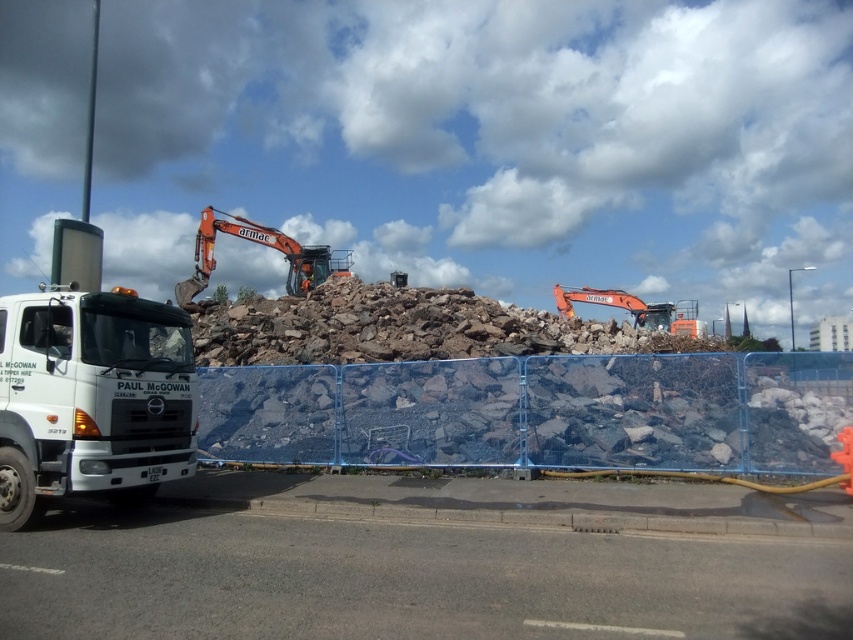
Is blue plastic fence at center positioned before orange metallic excavator at upper center?

Yes, blue plastic fence at center is closer to the viewer.

Does blue plastic fence at center have a lesser width compared to orange metallic excavator at upper center?

Yes, blue plastic fence at center is thinner than orange metallic excavator at upper center.

The width and height of the screenshot is (853, 640). What do you see at coordinates (537, 412) in the screenshot? I see `blue plastic fence at center` at bounding box center [537, 412].

Find the location of `blue plastic fence at center`. blue plastic fence at center is located at coordinates (537, 412).

Is white matte truck at left thinner than orange metallic excavator at center?

Correct, white matte truck at left's width is less than orange metallic excavator at center's.

Identify the location of white matte truck at left. The height and width of the screenshot is (640, 853). (90, 387).

Does point (42, 294) come farther from viewer compared to point (334, 260)?

No, it is in front of (334, 260).

You are a GUI agent. You are given a task and a screenshot of the screen. Output one action in this format:
    pyautogui.click(x=<x>, y=<y>)
    Task: Click on the white matte truck at left
    The height and width of the screenshot is (640, 853).
    Given the screenshot: What is the action you would take?
    pyautogui.click(x=90, y=387)

Can you confirm if blue plastic fence at center is shorter than white matte truck at left?

Correct, blue plastic fence at center is not as tall as white matte truck at left.

Between point (310, 372) and point (45, 465), which one is positioned in front?

Point (45, 465)

Where is `blue plastic fence at center`? The height and width of the screenshot is (640, 853). blue plastic fence at center is located at coordinates [x=537, y=412].